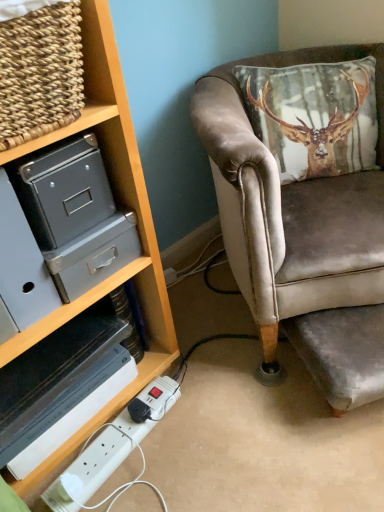
The width and height of the screenshot is (384, 512). I want to click on white plastic extension cord at lower left, so click(107, 452).

What do you see at coordinates (87, 90) in the screenshot? I see `woven wood basket at upper left` at bounding box center [87, 90].

Locate an element on the screen. The image size is (384, 512). velvet brown chair at right is located at coordinates (302, 236).

The height and width of the screenshot is (512, 384). Find the location of `white plastic extension cord at lower left`. white plastic extension cord at lower left is located at coordinates (107, 452).

From the image's perspective, which one is positioned higher, velvet brown chair at right or white plastic extension cord at lower left?

velvet brown chair at right, from the image's perspective.

From a real-world perspective, who is located lower, velvet brown chair at right or white plastic extension cord at lower left?

From a 3D spatial view, white plastic extension cord at lower left is below.

Which point is more distant from viewer, (321, 327) or (173, 387)?

Positioned behind is point (173, 387).

Based on the photo, between velvet brown chair at right and white plastic extension cord at lower left, which one has more height?

With more height is velvet brown chair at right.

Are white plastic extension cord at lower left and velvet brown chair at right beside each other?

No.

Which is more to the right, white plastic extension cord at lower left or velvet brown chair at right?

From the viewer's perspective, velvet brown chair at right appears more on the right side.

Which of these two, white plastic extension cord at lower left or velvet brown chair at right, is wider?

Wider between the two is velvet brown chair at right.

Could you tell me if white plastic extension cord at lower left is turned towards velvet brown chair at right?

No.

Between woven wood basket at upper left and white plastic extension cord at lower left, which one has larger size?

With larger size is woven wood basket at upper left.

How many degrees apart are the facing directions of woven wood basket at upper left and white plastic extension cord at lower left?

The angle between the facing direction of woven wood basket at upper left and the facing direction of white plastic extension cord at lower left is 3.78 degrees.

Is point (95, 116) closer or farther from the camera than point (62, 503)?

Point (95, 116) is positioned closer to the camera compared to point (62, 503).

From the image's perspective, is woven wood basket at upper left under white plastic extension cord at lower left?

No, from the image's perspective, woven wood basket at upper left is not below white plastic extension cord at lower left.

From a real-world perspective, between woven wood basket at upper left and velvet brown chair at right, who is vertically higher?

From a 3D spatial view, woven wood basket at upper left is above.

Is woven wood basket at upper left to the left or to the right of velvet brown chair at right in the image?

In the image, woven wood basket at upper left appears on the left side of velvet brown chair at right.

How much distance is there between woven wood basket at upper left and velvet brown chair at right?

woven wood basket at upper left and velvet brown chair at right are 20.26 inches apart.

Is velvet brown chair at right positioned with its back to woven wood basket at upper left?

No, woven wood basket at upper left is not at the back of velvet brown chair at right.

Is velvet brown chair at right beside woven wood basket at upper left?

There is a gap between velvet brown chair at right and woven wood basket at upper left.

Which is more to the left, velvet brown chair at right or woven wood basket at upper left?

woven wood basket at upper left is more to the left.

Locate an element on the screen. shelf lying in front of the velvet brown chair at right is located at coordinates (87, 90).

Locate an element on the screen. The width and height of the screenshot is (384, 512). extension cord on the right side of woven wood basket at upper left is located at coordinates (107, 452).

Considering the positions of objects white plastic extension cord at lower left and woven wood basket at upper left in the image provided, who is more to the left, white plastic extension cord at lower left or woven wood basket at upper left?

woven wood basket at upper left is more to the left.

Which object is closer to the camera taking this photo, white plastic extension cord at lower left or woven wood basket at upper left?

Positioned in front is woven wood basket at upper left.

From a real-world perspective, which is physically below, white plastic extension cord at lower left or woven wood basket at upper left?

white plastic extension cord at lower left.

Locate an element on the screen. This screenshot has width=384, height=512. chair in front of the white plastic extension cord at lower left is located at coordinates (302, 236).

At what (x,y) coordinates should I click in order to perform the action: click on chair that is above the white plastic extension cord at lower left (from the image's perspective). Please return your answer as a coordinate pair (x, y). This screenshot has width=384, height=512. Looking at the image, I should click on (302, 236).

Estimate the real-world distances between objects in this image. Which object is closer to white plastic extension cord at lower left, woven wood basket at upper left or velvet brown chair at right?

velvet brown chair at right.

From the image, which object appears to be farther from woven wood basket at upper left, velvet brown chair at right or white plastic extension cord at lower left?

Based on the image, white plastic extension cord at lower left appears to be further to woven wood basket at upper left.

From the image, which object appears to be farther from velvet brown chair at right, white plastic extension cord at lower left or woven wood basket at upper left?

white plastic extension cord at lower left lies further to velvet brown chair at right than the other object.

From the image, which object appears to be farther from white plastic extension cord at lower left, velvet brown chair at right or woven wood basket at upper left?

Based on the image, woven wood basket at upper left appears to be further to white plastic extension cord at lower left.

From the image, which object appears to be nearer to woven wood basket at upper left, white plastic extension cord at lower left or velvet brown chair at right?

velvet brown chair at right.

When comparing their distances from velvet brown chair at right, does woven wood basket at upper left or white plastic extension cord at lower left seem further?

Based on the image, white plastic extension cord at lower left appears to be further to velvet brown chair at right.

What are the coordinates of `chair that lies between woven wood basket at upper left and white plastic extension cord at lower left from top to bottom` in the screenshot? It's located at (302, 236).